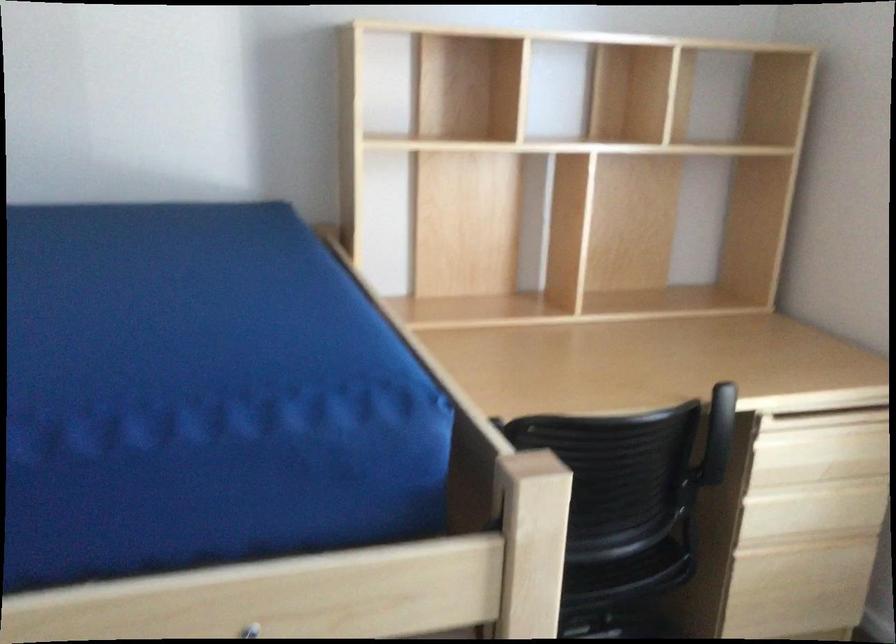
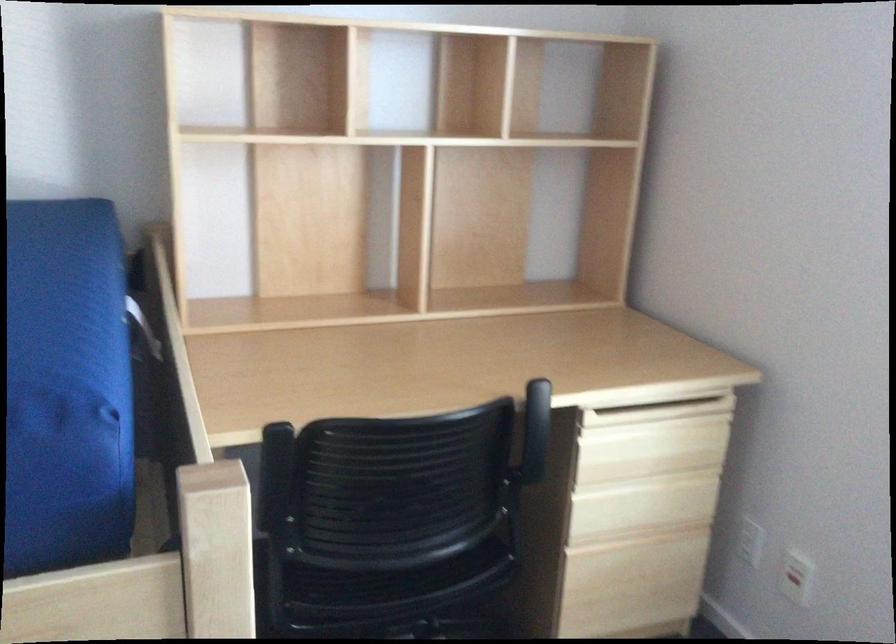
Where in the second image is the point corresponding to the point at 823,453 from the first image?

(650, 448)